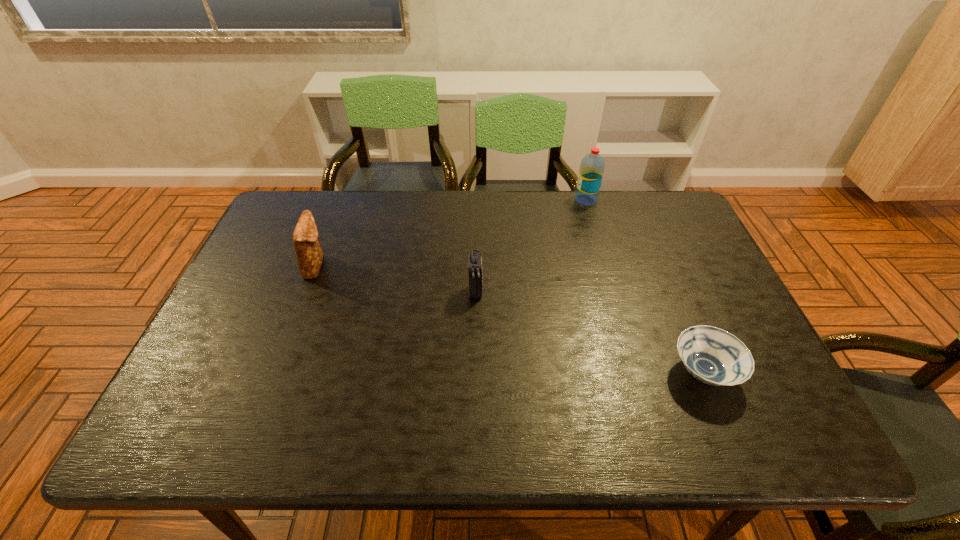
This screenshot has width=960, height=540. Identify the location of empty space between the leftmost object and the shorter clutch bag. (396, 278).

Find the location of a particular element. The image size is (960, 540). object that stands as the second closest to the third object from right to left is located at coordinates (714, 356).

Identify which object is located as the second nearest to the water bottle. Please provide its 2D coordinates. Your answer should be formatted as a tuple, i.e. [(x, y)], where the tuple contains the x and y coordinates of a point satisfying the conditions above.

[(714, 356)]

Locate an element on the screen. The image size is (960, 540). free region that satisfies the following two spatial constraints: 1. on the front label of the tallest object; 2. on the back side of the rightmost object is located at coordinates (636, 372).

Find the location of a particular element. The width and height of the screenshot is (960, 540). free space that satisfies the following two spatial constraints: 1. with the zip open on the soup bowl; 2. on the right side of the third tallest object is located at coordinates (475, 372).

Where is `vacant space that satisfies the following two spatial constraints: 1. on the front label of the tallest object; 2. on the back side of the soup bowl`? The height and width of the screenshot is (540, 960). vacant space that satisfies the following two spatial constraints: 1. on the front label of the tallest object; 2. on the back side of the soup bowl is located at coordinates (636, 372).

Image resolution: width=960 pixels, height=540 pixels. I want to click on free spot that satisfies the following two spatial constraints: 1. on the front label of the second object from right to left; 2. on the left side of the nearest object, so point(636,372).

At what (x,y) coordinates should I click in order to perform the action: click on vacant position in the image that satisfies the following two spatial constraints: 1. with the zip open on the right clutch bag; 2. on the left side of the shortest object. Please return your answer as a coordinate pair (x, y). Looking at the image, I should click on (475, 372).

Locate an element on the screen. The height and width of the screenshot is (540, 960). free spot that satisfies the following two spatial constraints: 1. on the front label of the rightmost object; 2. on the right side of the tallest object is located at coordinates (636, 372).